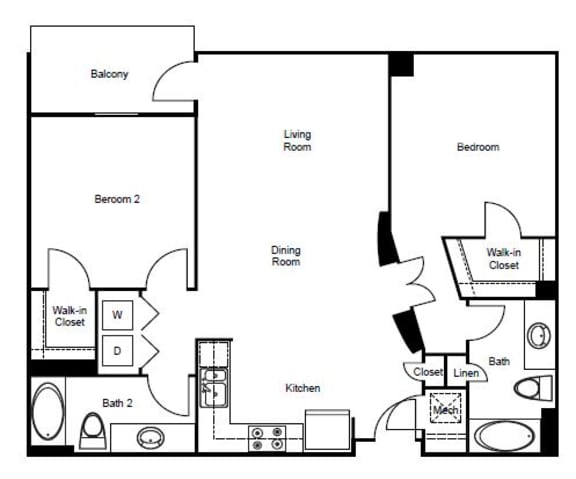
Identify the location of toilet. (93, 431), (530, 387).